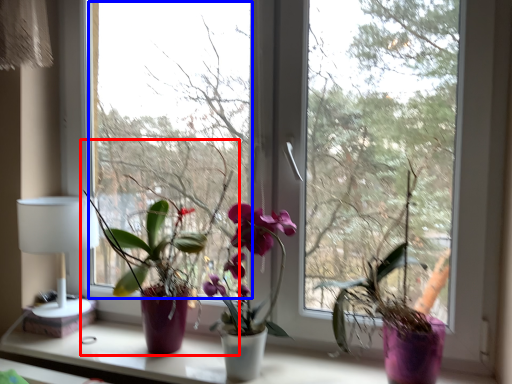
Question: Which point is closer to the camera, houseplant (highlighted by a red box) or window screen (highlighted by a blue box)?

Choices:
 (A) houseplant
 (B) window screen

Answer: (A)